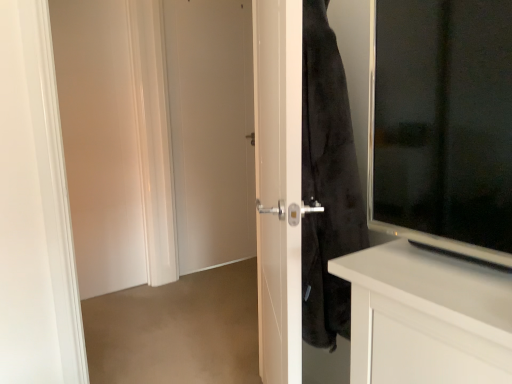
Question: Is white matte door at left, which ranks as the first screen door in left-to-right order, aimed at white matte door at center?

Choices:
 (A) yes
 (B) no

Answer: (B)

Question: Is white matte door at left, the 2th screen door when ordered from front to back, smaller than white matte door at center?

Choices:
 (A) yes
 (B) no

Answer: (A)

Question: Considering the relative positions of white matte door at left, the first screen door in the back-to-front sequence, and white matte door at center in the image provided, is white matte door at left, the first screen door in the back-to-front sequence, to the right of white matte door at center from the viewer's perspective?

Choices:
 (A) yes
 (B) no

Answer: (B)

Question: Is white matte door at left, the 2th screen door when ordered from front to back, positioned before white matte door at center?

Choices:
 (A) yes
 (B) no

Answer: (A)

Question: Considering the relative sizes of white matte door at left, the 2th screen door positioned from the right, and white matte door at center in the image provided, is white matte door at left, the 2th screen door positioned from the right, bigger than white matte door at center?

Choices:
 (A) no
 (B) yes

Answer: (A)

Question: From a real-world perspective, is white glossy door at center, positioned as the first screen door in front-to-back order, positioned above or below white matte door at center?

Choices:
 (A) below
 (B) above

Answer: (A)

Question: Is white glossy door at center, arranged as the first screen door when viewed from the right, bigger or smaller than white matte door at center?

Choices:
 (A) big
 (B) small

Answer: (A)

Question: From the image's perspective, is white glossy door at center, which is the second screen door from back to front, positioned above or below white matte door at center?

Choices:
 (A) above
 (B) below

Answer: (B)

Question: Is white glossy door at center, positioned as the first screen door in front-to-back order, to the left or to the right of white matte door at center in the image?

Choices:
 (A) right
 (B) left

Answer: (A)

Question: Looking at their shapes, would you say white matte door at left, the first screen door in the back-to-front sequence, is wider or thinner than white glossy door at center, positioned as the first screen door in front-to-back order?

Choices:
 (A) wide
 (B) thin

Answer: (B)

Question: Is white matte door at left, which ranks as the first screen door in left-to-right order, taller or shorter than white glossy door at center, which is the second screen door from back to front?

Choices:
 (A) short
 (B) tall

Answer: (B)

Question: Choose the correct answer: Is white matte door at left, the 2th screen door when ordered from front to back, inside white glossy door at center, which is the second screen door from back to front, or outside it?

Choices:
 (A) inside
 (B) outside

Answer: (B)

Question: Is point coord(75,213) positioned closer to the camera than point coord(100,195)?

Choices:
 (A) closer
 (B) farther

Answer: (A)

Question: In terms of size, does white matte door at center appear bigger or smaller than white matte door at left, which ranks as the first screen door in left-to-right order?

Choices:
 (A) small
 (B) big

Answer: (B)

Question: Does point (253, 180) appear closer or farther from the camera than point (137, 165)?

Choices:
 (A) farther
 (B) closer

Answer: (A)